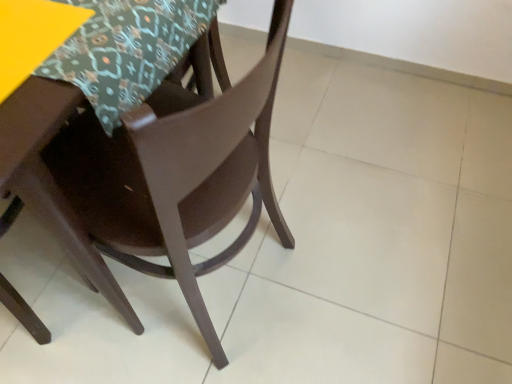
Question: Does patterned fabric tablecloth at upper left have a smaller size compared to matte brown chair at center?

Choices:
 (A) no
 (B) yes

Answer: (B)

Question: Considering the relative positions of patterned fabric tablecloth at upper left and matte brown chair at center in the image provided, is patterned fabric tablecloth at upper left in front of matte brown chair at center?

Choices:
 (A) yes
 (B) no

Answer: (B)

Question: Is patterned fabric tablecloth at upper left positioned far away from matte brown chair at center?

Choices:
 (A) no
 (B) yes

Answer: (A)

Question: Is patterned fabric tablecloth at upper left turned away from matte brown chair at center?

Choices:
 (A) yes
 (B) no

Answer: (A)

Question: Is the position of patterned fabric tablecloth at upper left more distant than that of matte brown chair at center?

Choices:
 (A) no
 (B) yes

Answer: (B)

Question: Considering the relative sizes of patterned fabric tablecloth at upper left and matte brown chair at center in the image provided, is patterned fabric tablecloth at upper left thinner than matte brown chair at center?

Choices:
 (A) no
 (B) yes

Answer: (B)

Question: From the image's perspective, is patterned fabric tablecloth at upper left beneath yellow matte table at upper left?

Choices:
 (A) no
 (B) yes

Answer: (A)

Question: Is patterned fabric tablecloth at upper left facing towards yellow matte table at upper left?

Choices:
 (A) no
 (B) yes

Answer: (B)

Question: Does patterned fabric tablecloth at upper left have a lesser height compared to yellow matte table at upper left?

Choices:
 (A) yes
 (B) no

Answer: (B)

Question: Is patterned fabric tablecloth at upper left thinner than yellow matte table at upper left?

Choices:
 (A) yes
 (B) no

Answer: (B)

Question: Considering the relative sizes of patterned fabric tablecloth at upper left and yellow matte table at upper left in the image provided, is patterned fabric tablecloth at upper left wider than yellow matte table at upper left?

Choices:
 (A) no
 (B) yes

Answer: (B)

Question: Can you confirm if patterned fabric tablecloth at upper left is positioned to the left of yellow matte table at upper left?

Choices:
 (A) yes
 (B) no

Answer: (B)

Question: Can you confirm if matte brown chair at center is smaller than yellow matte table at upper left?

Choices:
 (A) yes
 (B) no

Answer: (B)